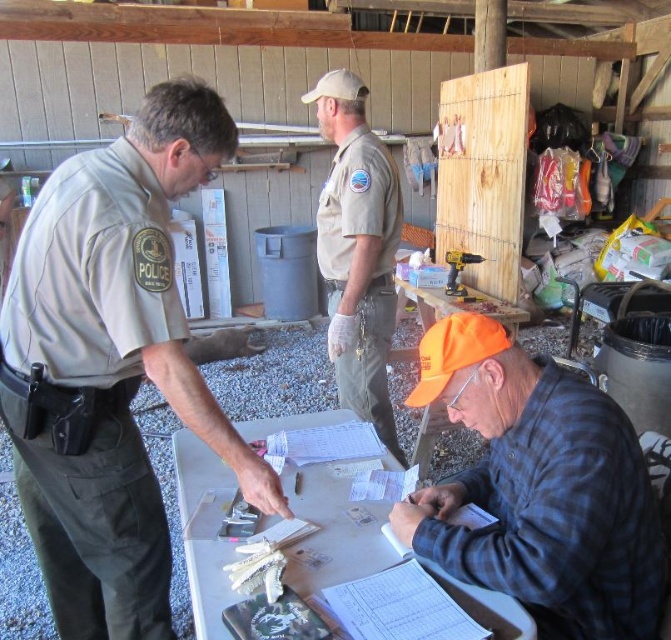
You are a delivery person who needs to hand over a package to the person in the tan uniform at left. However, you must maintain a safe distance of at least 3 feet from them. Can you approach the orange fabric cap at lower right to deliver the package without violating the safety guideline?

The tan uniform at left is 25.45 inches away from the orange fabric cap at lower right. Since 25.45 inches is less than 3 feet, approaching the orange fabric cap at lower right would bring you within the 3 feet safety distance from the tan uniform at left. Therefore, you cannot deliver the package without violating the safety guideline.

You are standing in the rustic shed and want to place a small object at the point closest to you. Which point should you choose between point (58,376) and point (360,269)?

Point (58,376) is closer to the camera, so you should choose point (58,376) to place the small object.